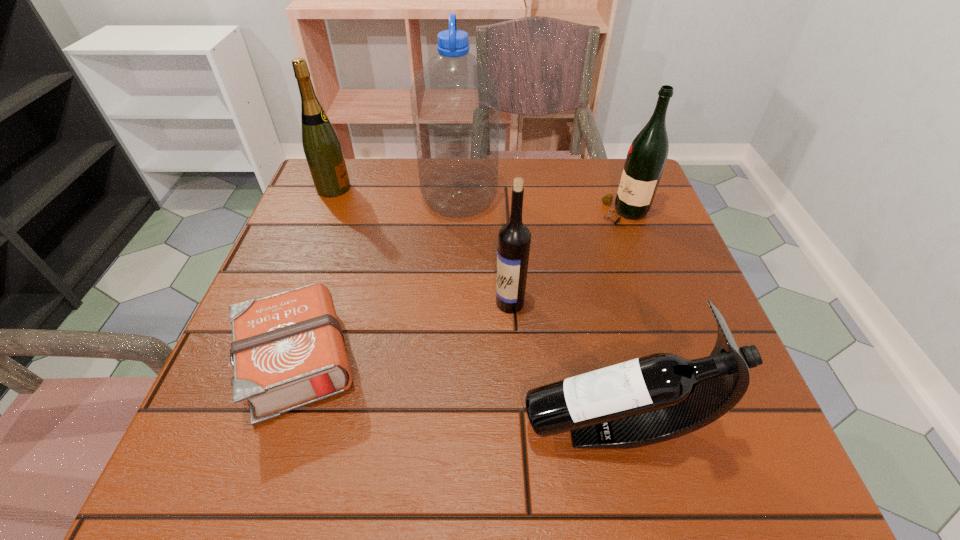
Find the location of a particular element. The image size is (960, 540). object that stands as the closest to the second farthest wine bottle is located at coordinates (455, 100).

The height and width of the screenshot is (540, 960). I want to click on object that can be found as the fifth closest to the second farthest wine bottle, so click(322, 148).

Point out which wine bottle is positioned as the third nearest to the third nearest wine bottle. Please provide its 2D coordinates. Your answer should be formatted as a tuple, i.e. [(x, y)], where the tuple contains the x and y coordinates of a point satisfying the conditions above.

[(322, 148)]

Where is `wine bottle that is the third closest to the Bible`? wine bottle that is the third closest to the Bible is located at coordinates (322, 148).

Find the location of a particular element. The width and height of the screenshot is (960, 540). vacant region that satisfies the following two spatial constraints: 1. on the front-facing side of the farthest wine bottle; 2. on the back side of the tallest object is located at coordinates (329, 200).

Where is `free space that satisfies the following two spatial constraints: 1. on the front-facing side of the leftmost wine bottle; 2. on the left side of the Bible`? free space that satisfies the following two spatial constraints: 1. on the front-facing side of the leftmost wine bottle; 2. on the left side of the Bible is located at coordinates (265, 361).

Where is `vacant space that satisfies the following two spatial constraints: 1. on the front-facing side of the water jug; 2. on the right side of the farthest wine bottle`? The height and width of the screenshot is (540, 960). vacant space that satisfies the following two spatial constraints: 1. on the front-facing side of the water jug; 2. on the right side of the farthest wine bottle is located at coordinates (329, 200).

You are a GUI agent. You are given a task and a screenshot of the screen. Output one action in this format:
    pyautogui.click(x=<x>, y=<y>)
    Task: Click on the vacant space that satisfies the following two spatial constraints: 1. on the back side of the water jug; 2. on the front-facing side of the leftmost wine bottle
    
    Given the screenshot: What is the action you would take?
    pyautogui.click(x=460, y=188)

Locate an element on the screen. The height and width of the screenshot is (540, 960). vacant space that satisfies the following two spatial constraints: 1. on the back side of the Bible; 2. on the front-facing side of the leftmost wine bottle is located at coordinates (356, 188).